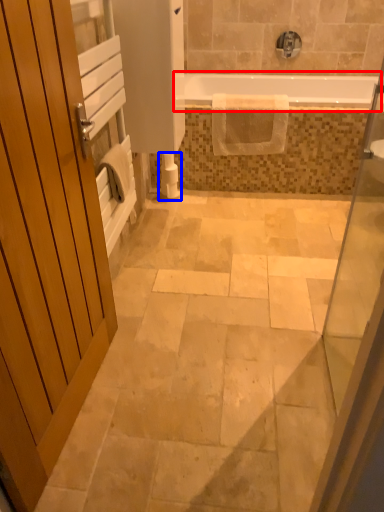
Question: Which point is further to the camera, bathtub (highlighted by a red box) or toilet paper (highlighted by a blue box)?

Choices:
 (A) bathtub
 (B) toilet paper

Answer: (B)